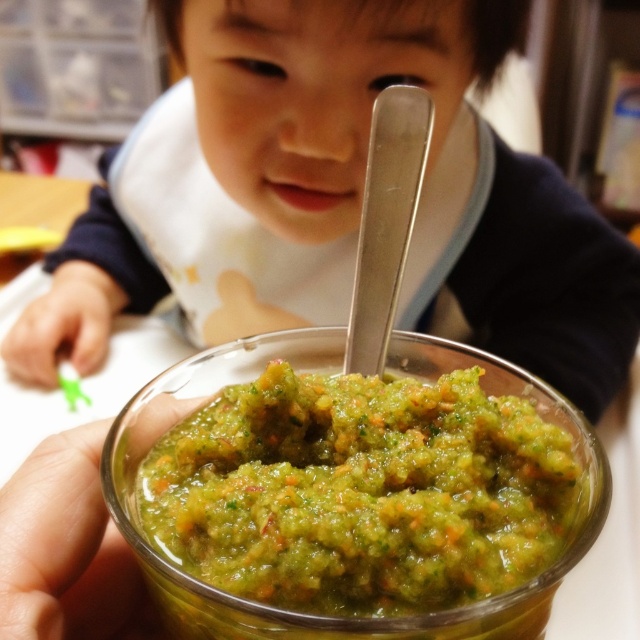
Based on the photo, what is the position of the point labeled as point (321, 92) in the image?

The point labeled as point (321, 92) is located on the matte white bib at upper center.

You are a parent trying to feed your child. You have a matte white bib at upper center and a shiny silver spoon at center. Which item is larger in size?

The matte white bib at upper center is bigger than the shiny silver spoon at center, so the matte white bib at upper center is larger in size.